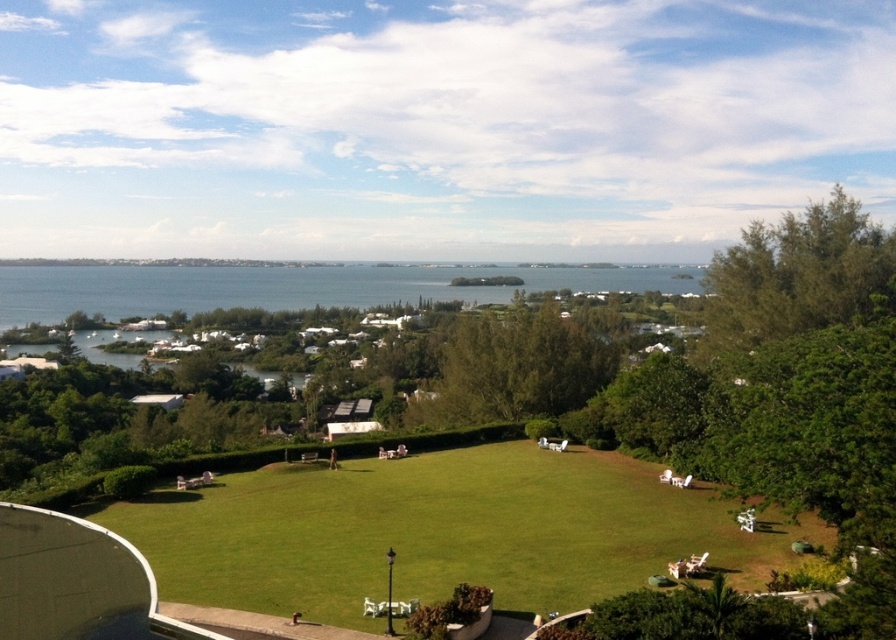
You are standing at the edge of the green grass lawn at center. If you walk straight ahead, will you eventually reach the body of water beyond the trees?

The green grass lawn at center is located at point (441, 532), which suggests it is positioned in the central part of the image. Since the scene describes the lawn stretching across the frame and the water being beyond the trees in the midground, walking straight ahead from the lawn would lead towards the water. Therefore, yes, you would eventually reach the body of water beyond the trees.

You are planning to place a large decorative statue that requires a stable, flat surface. Based on the scene, which object between the green grass lawn at center and the blue water at center would be more suitable for placing the statue?

The green grass lawn at center is shorter than the blue water at center, so placing the statue on the green grass lawn at center would be more suitable as it provides a stable and flat surface compared to the water.